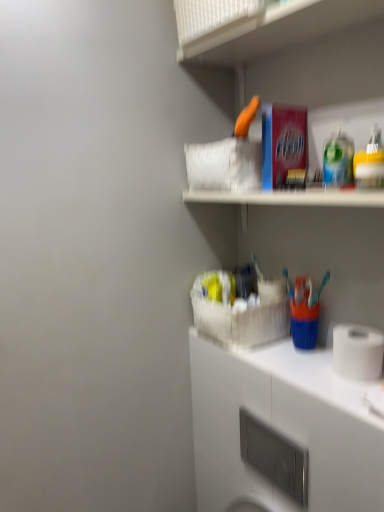
Question: In the image, is satin nickel soap dispenser at lower center positioned in front of or behind white matte cabinet at lower right?

Choices:
 (A) front
 (B) behind

Answer: (B)

Question: Is point (273, 458) closer or farther from the camera than point (375, 433)?

Choices:
 (A) farther
 (B) closer

Answer: (A)

Question: Estimate the real-world distances between objects in this image. Which object is farther from the white plastic basket at upper center?

Choices:
 (A) white matte cabinet at lower right
 (B) satin nickel soap dispenser at lower center
 (C) white matte toilet paper at lower right

Answer: (B)

Question: Which is nearer to the satin nickel soap dispenser at lower center?

Choices:
 (A) white matte cabinet at lower right
 (B) white matte toilet paper at lower right
 (C) white plastic basket at upper center

Answer: (A)